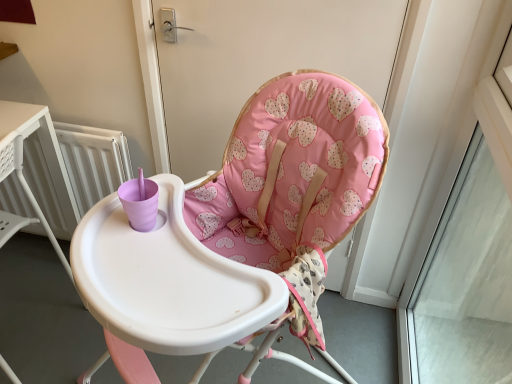
Question: Is pink fabric cushion at center aimed at white radiator at left?

Choices:
 (A) no
 (B) yes

Answer: (A)

Question: Is pink fabric cushion at center taller than white radiator at left?

Choices:
 (A) yes
 (B) no

Answer: (B)

Question: Is pink fabric cushion at center thinner than white radiator at left?

Choices:
 (A) no
 (B) yes

Answer: (B)

Question: From the image's perspective, is pink fabric cushion at center above white radiator at left?

Choices:
 (A) no
 (B) yes

Answer: (B)

Question: From a real-world perspective, is pink fabric cushion at center located beneath white radiator at left?

Choices:
 (A) yes
 (B) no

Answer: (B)

Question: Considering the positions of pink fabric highchair at center and pink fabric cushion at center in the image, is pink fabric highchair at center bigger or smaller than pink fabric cushion at center?

Choices:
 (A) big
 (B) small

Answer: (A)

Question: From the image's perspective, is pink fabric highchair at center positioned above or below pink fabric cushion at center?

Choices:
 (A) above
 (B) below

Answer: (B)

Question: In terms of height, does pink fabric highchair at center look taller or shorter compared to pink fabric cushion at center?

Choices:
 (A) short
 (B) tall

Answer: (B)

Question: In the image, is pink fabric highchair at center on the left side or the right side of pink fabric cushion at center?

Choices:
 (A) right
 (B) left

Answer: (B)

Question: Based on their sizes in the image, would you say transparent glass window at upper right is bigger or smaller than pink fabric cushion at center?

Choices:
 (A) big
 (B) small

Answer: (A)

Question: Visually, is transparent glass window at upper right positioned to the left or to the right of pink fabric cushion at center?

Choices:
 (A) left
 (B) right

Answer: (B)

Question: Considering their positions, is transparent glass window at upper right located in front of or behind pink fabric cushion at center?

Choices:
 (A) front
 (B) behind

Answer: (A)

Question: From a real-world perspective, relative to pink fabric cushion at center, is transparent glass window at upper right vertically above or below?

Choices:
 (A) above
 (B) below

Answer: (B)

Question: In the image, is pink fabric highchair at center on the left side or the right side of transparent glass window at upper right?

Choices:
 (A) right
 (B) left

Answer: (B)

Question: Is pink fabric highchair at center wider or thinner than transparent glass window at upper right?

Choices:
 (A) wide
 (B) thin

Answer: (A)